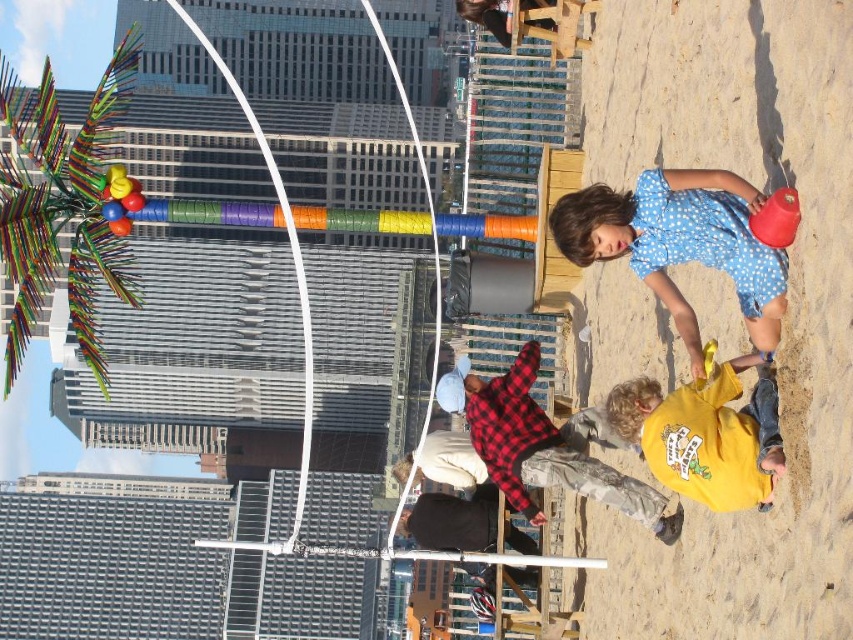
Question: Which is farther from the fine-grained sand at lower right?

Choices:
 (A) yellow cotton shirt at lower center
 (B) multicolored plastic palm tree at left
 (C) red plaid shirt at center

Answer: (B)

Question: Is the position of fine-grained sand at lower right more distant than that of red plaid shirt at center?

Choices:
 (A) yes
 (B) no

Answer: (B)

Question: Which point is farther to the camera?

Choices:
 (A) red plaid shirt at center
 (B) yellow cotton shirt at lower center
 (C) fine-grained sand at lower right

Answer: (A)

Question: Which of these objects is positioned farthest from the multicolored plastic palm tree at left?

Choices:
 (A) fine-grained sand at lower right
 (B) red plaid shirt at center
 (C) yellow cotton shirt at lower center

Answer: (C)

Question: Does fine-grained sand at lower right have a smaller size compared to red plaid shirt at center?

Choices:
 (A) no
 (B) yes

Answer: (A)

Question: Can you confirm if yellow cotton shirt at lower center is positioned to the right of red plaid shirt at center?

Choices:
 (A) no
 (B) yes

Answer: (B)